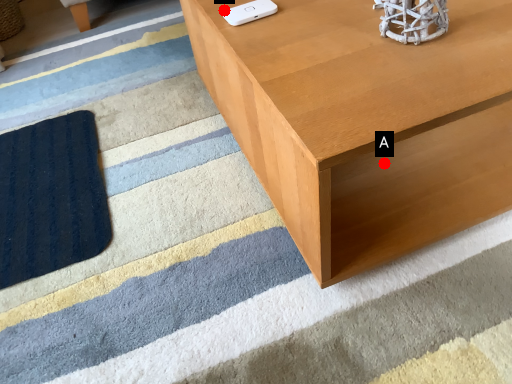
Question: Two points are circled on the image, labeled by A and B beside each circle. Which of the following is the closest to the observer?

Choices:
 (A) A is closer
 (B) B is closer

Answer: (B)